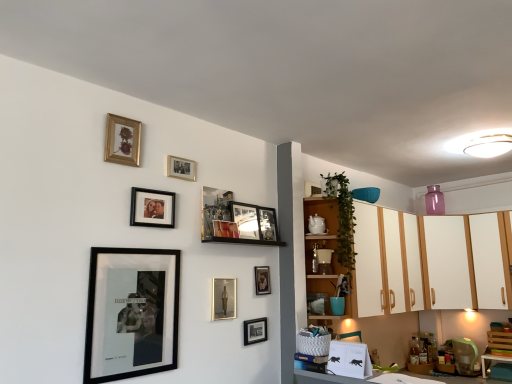
Question: In terms of height, does wooden cabinet at upper right look taller or shorter compared to black matte picture frame at lower left, placed as the 9th picture frame when sorted from top to bottom?

Choices:
 (A) tall
 (B) short

Answer: (A)

Question: Based on their sizes in the image, would you say wooden cabinet at upper right is bigger or smaller than black matte picture frame at lower left, positioned as the 3th picture frame in bottom-to-top order?

Choices:
 (A) big
 (B) small

Answer: (A)

Question: Estimate the real-world distances between objects in this image. Which object is closer to the white glossy cabinets at upper right, which ranks as the 2th cabinetry in right-to-left order?

Choices:
 (A) metallic silver photo frame at upper center, positioned as the 4th picture frame in top-to-bottom order
 (B) white glossy cabinet at right
 (C) black matte picture frame at upper center, which is counted as the 3th picture frame, starting from the top
 (D) metallic silver portrait at center, marked as the tenth picture frame in a top-to-bottom arrangement
 (E) white matte cabinet at upper right, which ranks as the first cabinetry in right-to-left order

Answer: (E)

Question: Which object is positioned farthest from the white glossy cabinets at upper right, which ranks as the 2th cabinetry in right-to-left order?

Choices:
 (A) gold-framed photo at upper center, which is the 2th picture frame from top to bottom
 (B) white matte cabinet at upper right, which ranks as the 1th cabinetry in left-to-right order
 (C) black matte picture frame at upper center, which is counted as the 3th picture frame, starting from the top
 (D) metallic silver portrait at center, the second picture frame in the bottom-to-top sequence
 (E) wooden cabinet at upper right

Answer: (C)